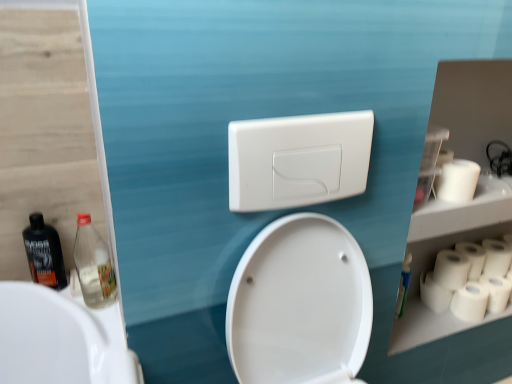
Find the location of a particular element. blank space to the left of white matte toilet paper at right, arranged as the sixth toilet paper when viewed from the top is located at coordinates (428, 320).